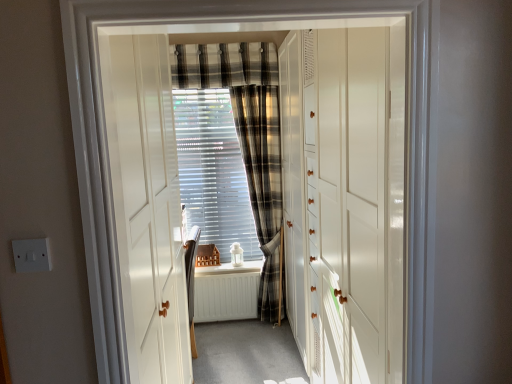
This screenshot has height=384, width=512. Identify the location of vacant area that is in front of plaid fabric curtain at center, positioned as the 1th curtain in bottom-to-top order. (262, 338).